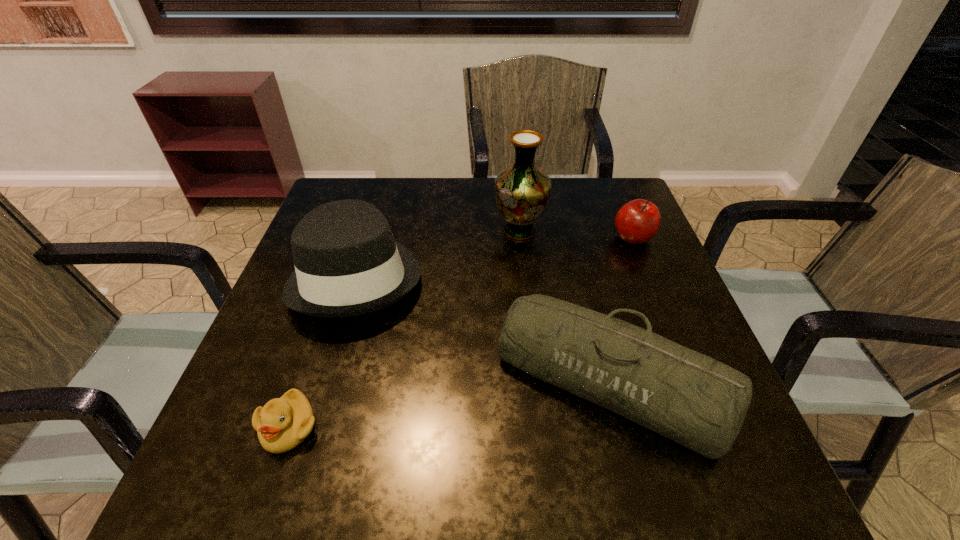
Where is `empty space that is in between the fourth shortest object and the duckling`? This screenshot has height=540, width=960. empty space that is in between the fourth shortest object and the duckling is located at coordinates (323, 352).

Locate an element on the screen. free spot between the second tallest object and the tallest object is located at coordinates (439, 253).

Where is `the closest object to the duffel bag`? the closest object to the duffel bag is located at coordinates (347, 263).

This screenshot has width=960, height=540. What are the coordinates of `object that is the closest one to the duffel bag` in the screenshot? It's located at (347, 263).

The height and width of the screenshot is (540, 960). Find the location of `free space that satisfies the following two spatial constraints: 1. on the front side of the duffel bag; 2. on the right side of the fourth shortest object`. free space that satisfies the following two spatial constraints: 1. on the front side of the duffel bag; 2. on the right side of the fourth shortest object is located at coordinates (325, 380).